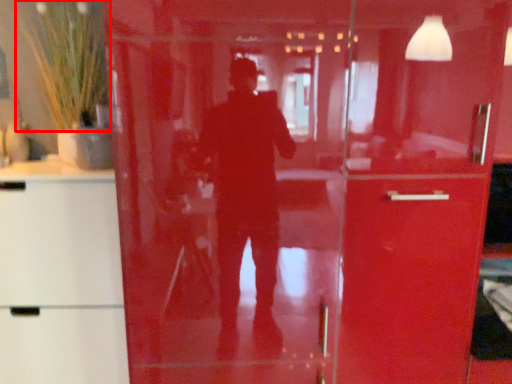
Question: From the image's perspective, what is the correct spatial relationship of plant (annotated by the red box) in relation to cabinetry?

Choices:
 (A) above
 (B) below

Answer: (A)